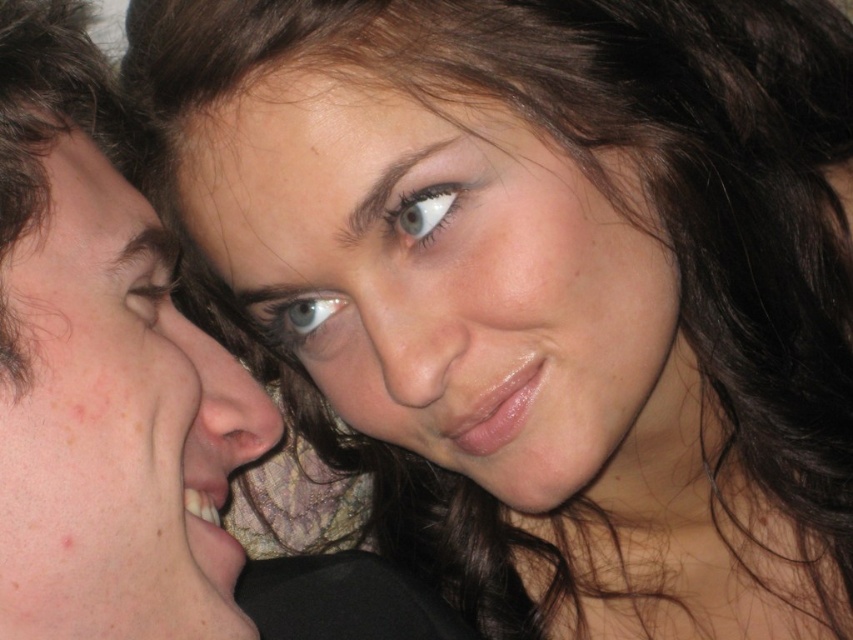
What do you see at coordinates (453, 284) in the screenshot?
I see `smooth skin face at center` at bounding box center [453, 284].

Is smooth skin face at center to the right of blue glossy eye at center from the viewer's perspective?

Yes, smooth skin face at center is to the right of blue glossy eye at center.

The image size is (853, 640). What do you see at coordinates (453, 284) in the screenshot?
I see `smooth skin face at center` at bounding box center [453, 284].

Where is `smooth skin face at center`? smooth skin face at center is located at coordinates (453, 284).

Is brown matte eyebrow at upper center thinner than brown hair at upper left?

No, brown matte eyebrow at upper center is not thinner than brown hair at upper left.

The width and height of the screenshot is (853, 640). I want to click on brown matte eyebrow at upper center, so click(x=410, y=193).

This screenshot has height=640, width=853. Describe the element at coordinates (410, 193) in the screenshot. I see `brown matte eyebrow at upper center` at that location.

The height and width of the screenshot is (640, 853). I want to click on brown matte eyebrow at upper center, so click(410, 193).

From the picture: Can you confirm if matte skin nose at center is positioned to the left of blue matte eye at upper left?

In fact, matte skin nose at center is to the right of blue matte eye at upper left.

Does point (253, 410) lie in front of point (161, 280)?

Yes, point (253, 410) is in front of point (161, 280).

The width and height of the screenshot is (853, 640). What do you see at coordinates (224, 400) in the screenshot? I see `matte skin nose at center` at bounding box center [224, 400].

Find the location of a particular element. matte skin nose at center is located at coordinates (224, 400).